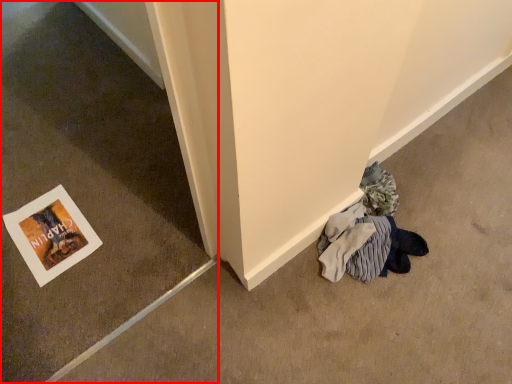
Question: From the image, what is the correct spatial relationship of concrete (annotated by the red box) in relation to picture frame?

Choices:
 (A) left
 (B) right

Answer: (B)